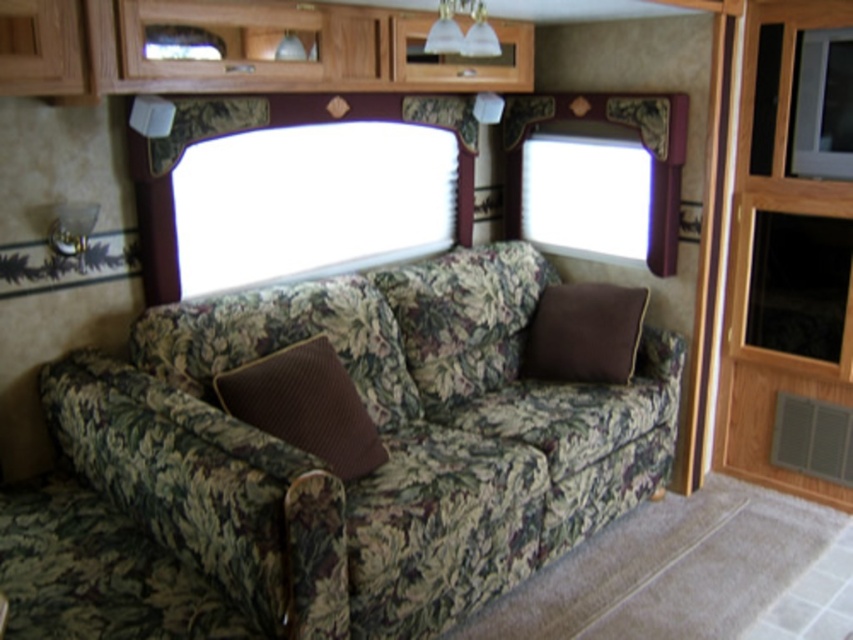
You are sitting on the floral sofa and want to place a book on the nearest pillow. Which pillow should you choose between the brown textured pillow at center and the brown cotton pillow at center?

The brown textured pillow at center is below the brown cotton pillow at center, so the brown cotton pillow at center is the one on top and closer to you. You should choose the brown cotton pillow at center to place your book.

You are a delivery person who needs to place a rectangular package that is 12 inches long. You have to put it between the floral fabric couch at center and the brown textured pillow at center. Is there enough space for the package to fit between them?

The floral fabric couch at center and brown textured pillow at center are 12.41 inches apart from each other. Since the package is 12 inches long, it can fit between them as the space is slightly larger than the package.

You are sitting on the floral fabric couch at center and want to place a book on the brown cotton pillow at center. Can you reach the pillow from your current position?

The floral fabric couch at center is to the left of the brown cotton pillow at center, so you can easily reach the pillow from the couch.